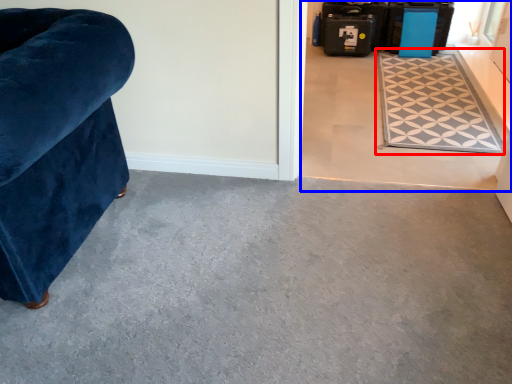
Question: Which object is further to the camera taking this photo, mat (highlighted by a red box) or concrete (highlighted by a blue box)?

Choices:
 (A) mat
 (B) concrete

Answer: (A)